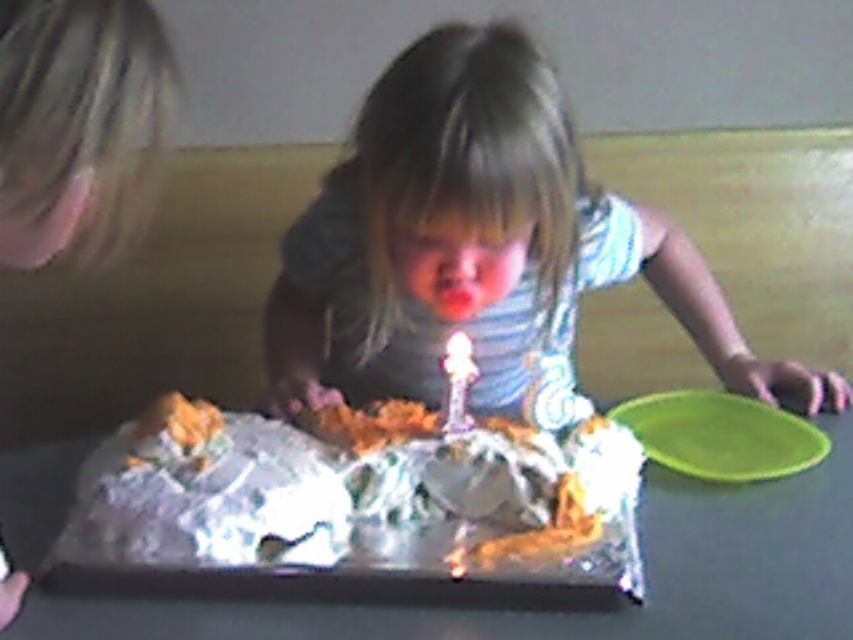
Who is higher up, green plastic plate at lower right or white plastic candle at center?

Positioned higher is white plastic candle at center.

This screenshot has width=853, height=640. Describe the element at coordinates (721, 435) in the screenshot. I see `green plastic plate at lower right` at that location.

Find the location of a particular element. The width and height of the screenshot is (853, 640). green plastic plate at lower right is located at coordinates (721, 435).

Between striped fabric shirt at center and white plastic candle at center, which one has more height?

striped fabric shirt at center

Who is lower down, striped fabric shirt at center or white plastic candle at center?

white plastic candle at center

I want to click on striped fabric shirt at center, so click(480, 246).

Can you confirm if shiny aluminum tray at center is positioned below green plastic plate at lower right?

Yes.

Between shiny aluminum tray at center and green plastic plate at lower right, which one is positioned lower?

shiny aluminum tray at center is lower down.

Which is in front, point (39, 547) or point (817, 451)?

Positioned in front is point (39, 547).

Image resolution: width=853 pixels, height=640 pixels. I want to click on shiny aluminum tray at center, so click(x=596, y=614).